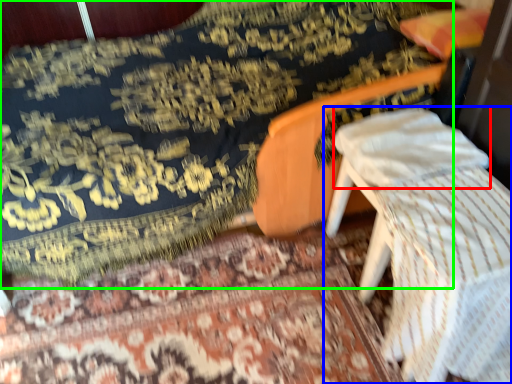
Question: Which object is the farthest from pillow (highlighted by a red box)? Choose among these: furniture (highlighted by a blue box) or mattress (highlighted by a green box).

Choices:
 (A) furniture
 (B) mattress

Answer: (B)